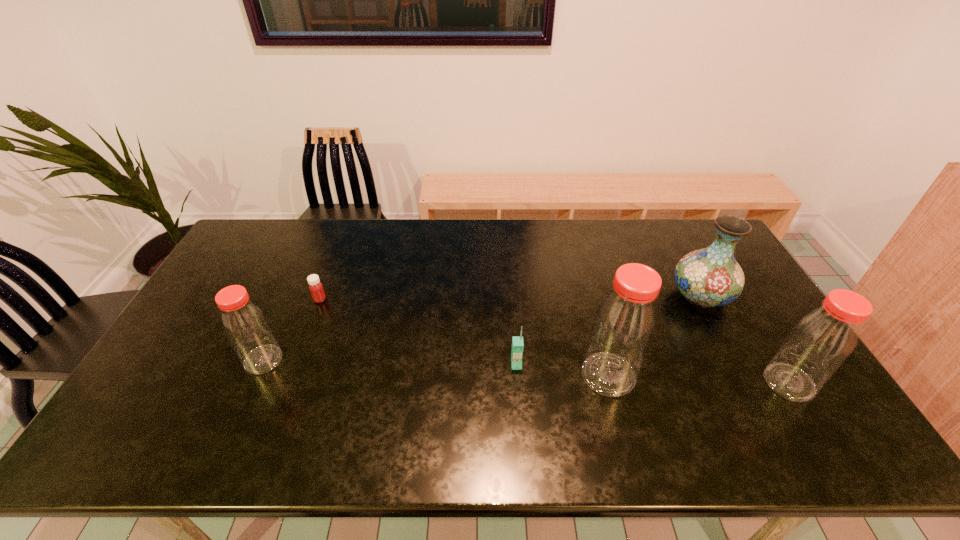
This screenshot has width=960, height=540. In order to click on the leftmost bottle in this screenshot , I will do `click(245, 325)`.

The height and width of the screenshot is (540, 960). I want to click on the shortest bottle, so (x=245, y=325).

Identify the location of the fourth object from left to right. (624, 325).

Where is `the rightmost bottle`? the rightmost bottle is located at coordinates (822, 340).

The image size is (960, 540). I want to click on cellular telephone, so click(517, 341).

At what (x,y) coordinates should I click in order to perform the action: click on the fifth tallest object. Please return your answer as a coordinate pair (x, y). The width and height of the screenshot is (960, 540). Looking at the image, I should click on (517, 341).

The height and width of the screenshot is (540, 960). Find the location of `vase`. vase is located at coordinates (710, 277).

The image size is (960, 540). In order to click on the shortest object in this screenshot , I will do `click(316, 289)`.

Find the location of a particular element. The image size is (960, 540). medicine is located at coordinates (316, 289).

Where is `vacant space located 0.370m on the back of the shortest bottle`? The image size is (960, 540). vacant space located 0.370m on the back of the shortest bottle is located at coordinates (308, 261).